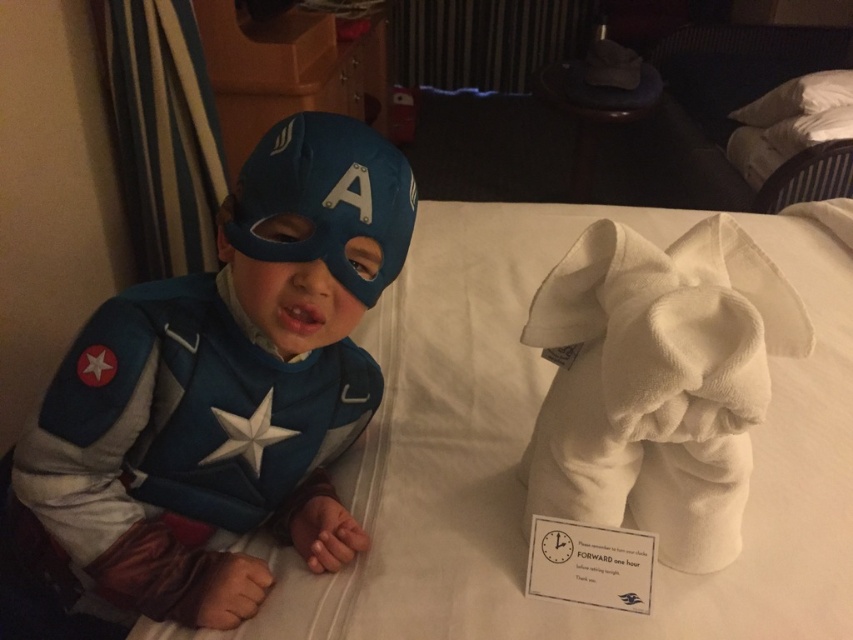
You are a parent trying to ensure your child is dressed appropriately for a superhero party. You see the blue fabric costume at left on the bed. Can you reach it from where you are standing if you can extend your arm 70 centimeters?

The blue fabric costume at left is 69.80 centimeters away from the viewer. Since you can extend your arm 70 centimeters, you can just barely reach the blue fabric costume at left.

In the scene shown: You are a parent checking the bed setup for your child. You have the blue fabric costume at left and the white soft pillow at upper right. Which object is taller?

The blue fabric costume at left is taller than the white soft pillow at upper right.